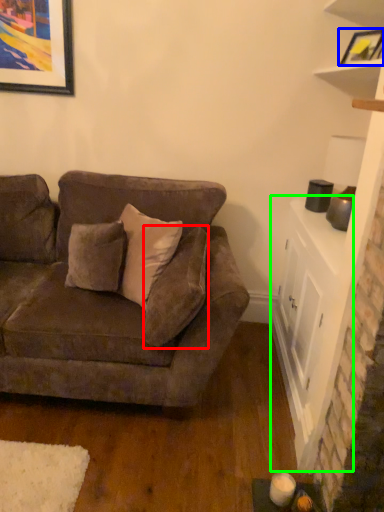
Question: Which object is positioned farthest from pillow (highlighted by a red box)? Select from picture frame (highlighted by a blue box) and table (highlighted by a green box).

Choices:
 (A) picture frame
 (B) table

Answer: (A)